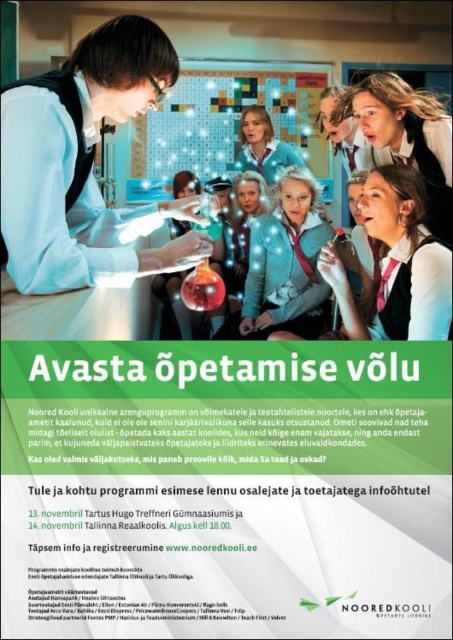
Does white paper at center have a lesser height compared to matte black lab coat at center?

Yes, white paper at center is shorter than matte black lab coat at center.

Does white paper at center appear on the left side of matte black lab coat at center?

In fact, white paper at center is to the right of matte black lab coat at center.

Which is in front, point (94, 408) or point (13, 214)?

Positioned in front is point (94, 408).

The width and height of the screenshot is (453, 640). I want to click on white paper at center, so click(x=226, y=490).

Who is more forward, [438,346] or [184,124]?

Point [438,346]

Which is behind, point (85, 401) or point (210, 140)?

The point (210, 140) is behind.

Which is behind, point (52, 577) or point (313, 131)?

Point (313, 131)

Where is `white paper at center`? The width and height of the screenshot is (453, 640). white paper at center is located at coordinates (226, 490).

Is white paper at center shorter than white fabric shirt at upper right?

Indeed, white paper at center has a lesser height compared to white fabric shirt at upper right.

Between white paper at center and white fabric shirt at upper right, which one appears on the left side from the viewer's perspective?

white paper at center is more to the left.

Who is more forward, (211, 440) or (372, 228)?

Point (211, 440) is in front.

Identify the location of white paper at center. (226, 490).